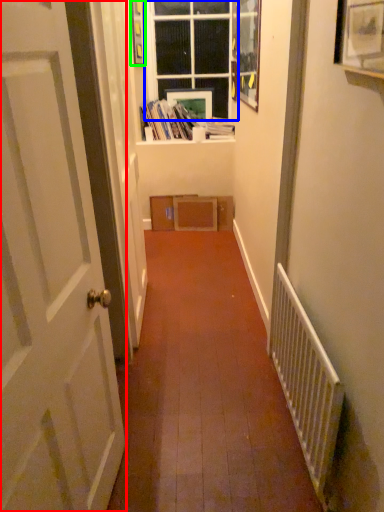
Question: Which is nearer to the door (highlighted by a red box)? window (highlighted by a blue box) or picture frame (highlighted by a green box).

Choices:
 (A) window
 (B) picture frame

Answer: (B)